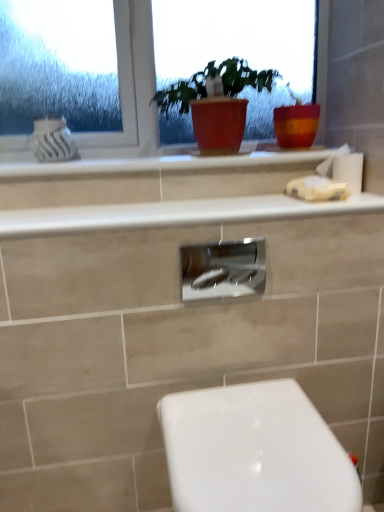
Question: Does white glossy toilet at lower right lie in front of matte red pot at center?

Choices:
 (A) yes
 (B) no

Answer: (A)

Question: Does white glossy toilet at lower right touch matte red pot at center?

Choices:
 (A) no
 (B) yes

Answer: (A)

Question: Is white glossy toilet at lower right positioned behind matte red pot at center?

Choices:
 (A) no
 (B) yes

Answer: (A)

Question: From a real-world perspective, is white glossy toilet at lower right physically above matte red pot at center?

Choices:
 (A) no
 (B) yes

Answer: (A)

Question: Is white glossy toilet at lower right aimed at matte red pot at center?

Choices:
 (A) yes
 (B) no

Answer: (B)

Question: From a real-world perspective, is white glossy toilet at lower right physically located above or below white glossy counter top at upper center, the 2th counter top viewed from the top?

Choices:
 (A) above
 (B) below

Answer: (B)

Question: From the image's perspective, is white glossy toilet at lower right above or below white glossy counter top at upper center, the 2th counter top viewed from the top?

Choices:
 (A) below
 (B) above

Answer: (A)

Question: In terms of size, does white glossy toilet at lower right appear bigger or smaller than white glossy counter top at upper center, the 2th counter top viewed from the top?

Choices:
 (A) small
 (B) big

Answer: (B)

Question: Is white glossy toilet at lower right to the left or to the right of white glossy counter top at upper center, the 1th counter top from the bottom, in the image?

Choices:
 (A) left
 (B) right

Answer: (B)

Question: From a real-world perspective, is white matte tissue at right positioned above or below matte red pot at center?

Choices:
 (A) below
 (B) above

Answer: (A)

Question: Is white matte tissue at right in front of or behind matte red pot at center in the image?

Choices:
 (A) front
 (B) behind

Answer: (B)

Question: Considering the positions of white matte tissue at right and matte red pot at center in the image, is white matte tissue at right wider or thinner than matte red pot at center?

Choices:
 (A) thin
 (B) wide

Answer: (A)

Question: Considering the positions of point (317, 167) and point (236, 133), is point (317, 167) closer or farther from the camera than point (236, 133)?

Choices:
 (A) farther
 (B) closer

Answer: (A)

Question: Is point (326, 169) closer or farther from the camera than point (259, 289)?

Choices:
 (A) closer
 (B) farther

Answer: (B)

Question: From the image's perspective, is white matte tissue at right above or below satin nickel faucet at center?

Choices:
 (A) below
 (B) above

Answer: (B)